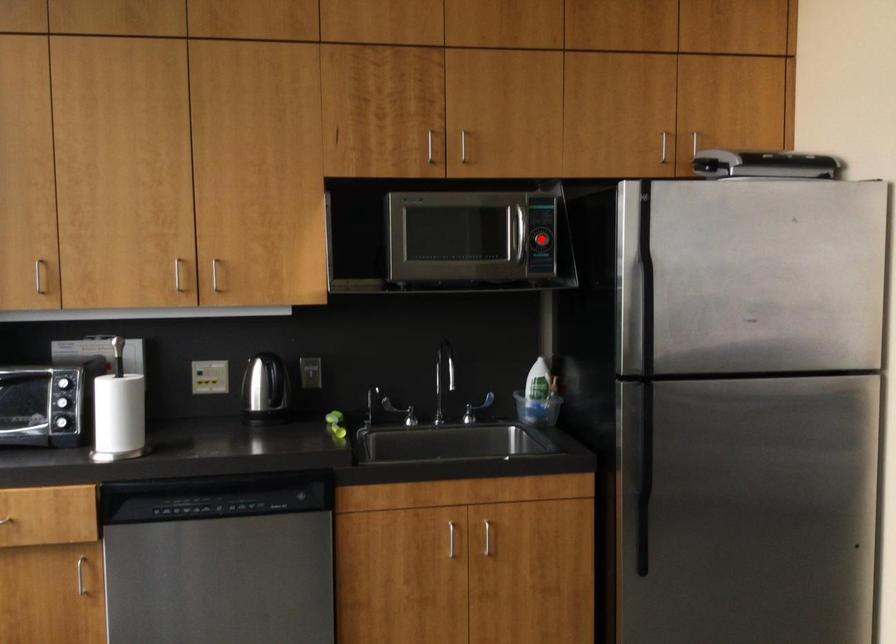
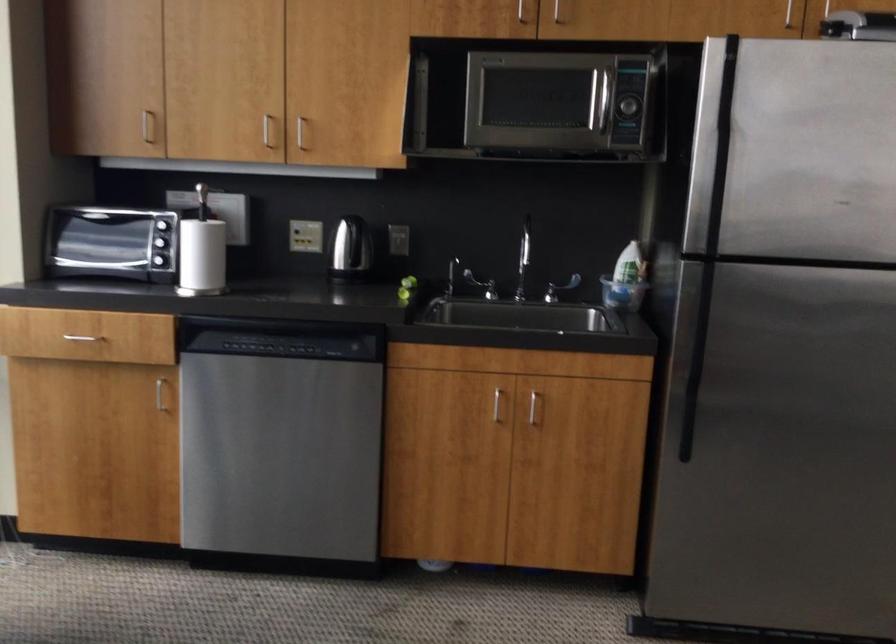
Locate, in the second image, the point that corresponds to the highlighted location in the first image.

(626, 106)